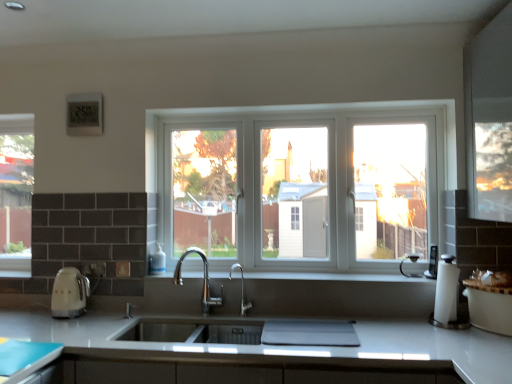
Question: From a real-world perspective, is white smooth window sill at center physically below matte cream kettle at left, arranged as the 2th appliance when viewed from the right?

Choices:
 (A) yes
 (B) no

Answer: (B)

Question: Considering the relative sizes of white smooth window sill at center and matte cream kettle at left, positioned as the 1th appliance in left-to-right order, in the image provided, is white smooth window sill at center smaller than matte cream kettle at left, positioned as the 1th appliance in left-to-right order,?

Choices:
 (A) no
 (B) yes

Answer: (A)

Question: From a real-world perspective, does white smooth window sill at center stand above matte cream kettle at left, positioned as the 1th appliance in left-to-right order?

Choices:
 (A) no
 (B) yes

Answer: (B)

Question: Is white smooth window sill at center taller than matte cream kettle at left, arranged as the 2th appliance when viewed from the right?

Choices:
 (A) no
 (B) yes

Answer: (A)

Question: Can you confirm if white smooth window sill at center is thinner than matte cream kettle at left, arranged as the 2th appliance when viewed from the right?

Choices:
 (A) yes
 (B) no

Answer: (B)

Question: Considering the positions of matte white countertop at lower left and white smooth window sill at center in the image, is matte white countertop at lower left wider or thinner than white smooth window sill at center?

Choices:
 (A) thin
 (B) wide

Answer: (B)

Question: Considering the relative positions of matte white countertop at lower left and white smooth window sill at center in the image provided, is matte white countertop at lower left to the left or to the right of white smooth window sill at center?

Choices:
 (A) right
 (B) left

Answer: (B)

Question: Which is correct: matte white countertop at lower left is inside white smooth window sill at center, or outside of it?

Choices:
 (A) outside
 (B) inside

Answer: (A)

Question: Considering the positions of point [x=15, y=344] and point [x=198, y=278], is point [x=15, y=344] closer or farther from the camera than point [x=198, y=278]?

Choices:
 (A) farther
 (B) closer

Answer: (B)

Question: Would you say clear glass window at left, the second window viewed from the right, is inside or outside matte cream kettle at left, arranged as the 2th appliance when viewed from the right?

Choices:
 (A) inside
 (B) outside

Answer: (B)

Question: Considering the positions of point (5, 215) and point (73, 269), is point (5, 215) closer or farther from the camera than point (73, 269)?

Choices:
 (A) closer
 (B) farther

Answer: (B)

Question: Considering the positions of clear glass window at left, the 2th window positioned from the front, and matte cream kettle at left, arranged as the 2th appliance when viewed from the right, in the image, is clear glass window at left, the 2th window positioned from the front, wider or thinner than matte cream kettle at left, arranged as the 2th appliance when viewed from the right,?

Choices:
 (A) thin
 (B) wide

Answer: (A)

Question: Would you say clear glass window at left, which is the first window from back to front, is to the left or to the right of matte cream kettle at left, positioned as the 1th appliance in left-to-right order, in the picture?

Choices:
 (A) left
 (B) right

Answer: (A)

Question: Is white glossy countertop at center wider or thinner than matte cream kettle at left, arranged as the 2th appliance when viewed from the right?

Choices:
 (A) thin
 (B) wide

Answer: (B)

Question: In the image, is white glossy countertop at center positioned in front of or behind matte cream kettle at left, positioned as the 1th appliance in left-to-right order?

Choices:
 (A) front
 (B) behind

Answer: (A)